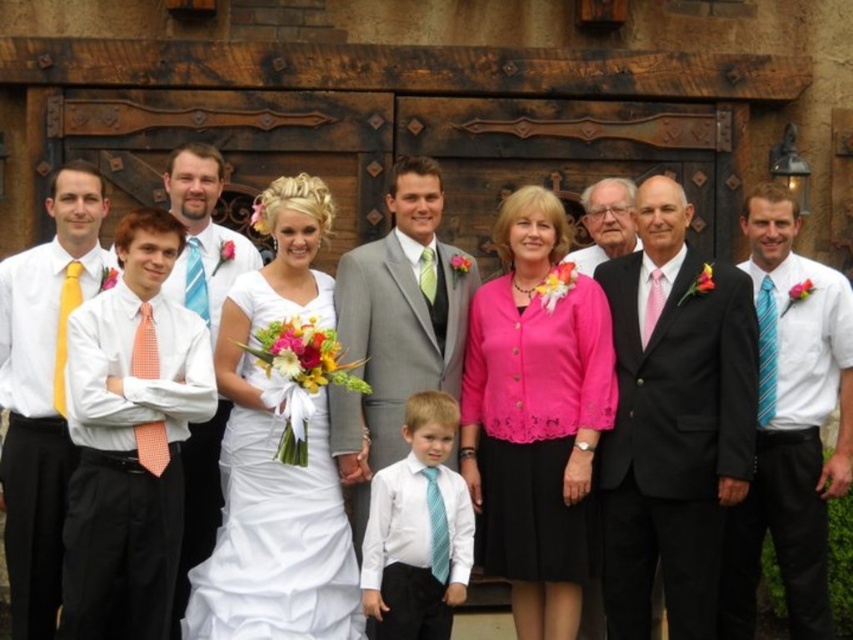
Is matte orange tie at left above green silk tie at center?

Incorrect, matte orange tie at left is not positioned above green silk tie at center.

From the picture: Which of these two, matte orange tie at left or green silk tie at center, stands shorter?

green silk tie at center

In order to click on matte orange tie at left in this screenshot , I will do `click(207, 220)`.

Does blue striped tie at right come in front of blue striped tie at center?

Yes, blue striped tie at right is in front of blue striped tie at center.

Does blue striped tie at right have a smaller size compared to blue striped tie at center?

No, blue striped tie at right is not smaller than blue striped tie at center.

In order to click on blue striped tie at right in this screenshot , I will do `click(766, 349)`.

Between point (572, 445) and point (157, 368), which one is positioned in front?

Point (157, 368) is more forward.

Which of these two, pink fabric dress at center or orange dotted tie at left, stands taller?

pink fabric dress at center is taller.

Describe the element at coordinates (535, 416) in the screenshot. I see `pink fabric dress at center` at that location.

Find the location of `pink fabric dress at center`. pink fabric dress at center is located at coordinates (535, 416).